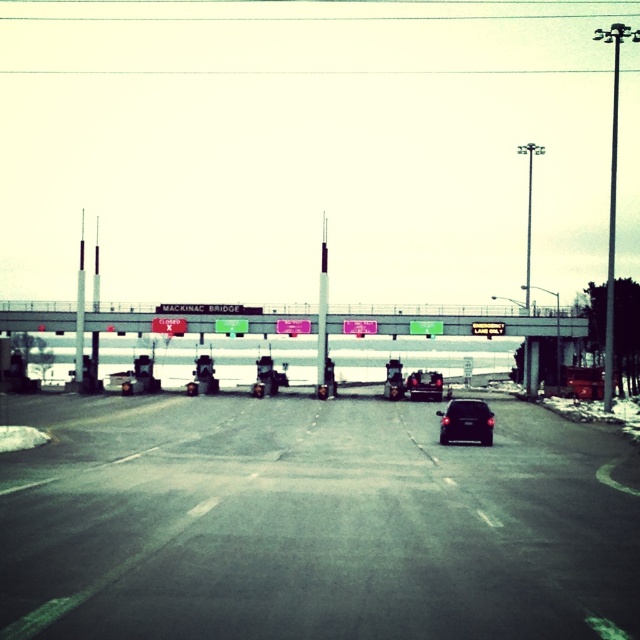
Is metallic gray bridge at center smaller than matte black car at center?

Incorrect, metallic gray bridge at center is not smaller in size than matte black car at center.

Looking at this image, between metallic gray bridge at center and matte black car at center, which one has more height?

metallic gray bridge at center

This screenshot has width=640, height=640. In order to click on metallic gray bridge at center in this screenshot , I will do `click(467, 323)`.

Is metallic gray bridge at center shorter than black matte car at center?

Indeed, metallic gray bridge at center has a lesser height compared to black matte car at center.

Who is more distant from viewer, (124, 326) or (394, 397)?

The point (124, 326) is behind.

Who is more distant from viewer, (333, 332) or (394, 371)?

Point (333, 332)

Identify the location of metallic gray bridge at center. (467, 323).

Does metallic gray bridge at center have a smaller size compared to metallic pole at right?

Correct, metallic gray bridge at center occupies less space than metallic pole at right.

Who is lower down, metallic gray bridge at center or metallic pole at right?

metallic gray bridge at center is lower down.

Is point (378, 323) closer to camera compared to point (612, 145)?

Yes, it is in front of point (612, 145).

You are a GUI agent. You are given a task and a screenshot of the screen. Output one action in this format:
    pyautogui.click(x=<x>, y=<y>)
    Task: Click on the metallic gray bridge at center
    This screenshot has width=640, height=640.
    Given the screenshot: What is the action you would take?
    pyautogui.click(x=467, y=323)